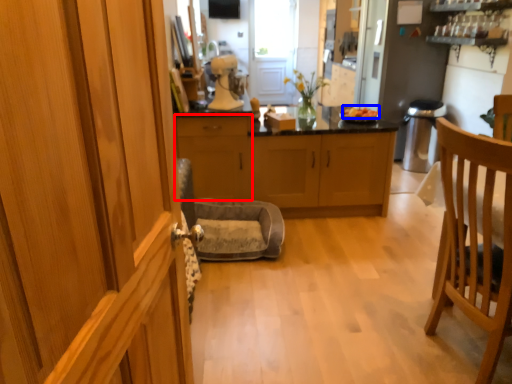
Question: Which object appears closest to the camera in this image, cabinetry (highlighted by a red box) or food (highlighted by a blue box)?

Choices:
 (A) cabinetry
 (B) food

Answer: (A)